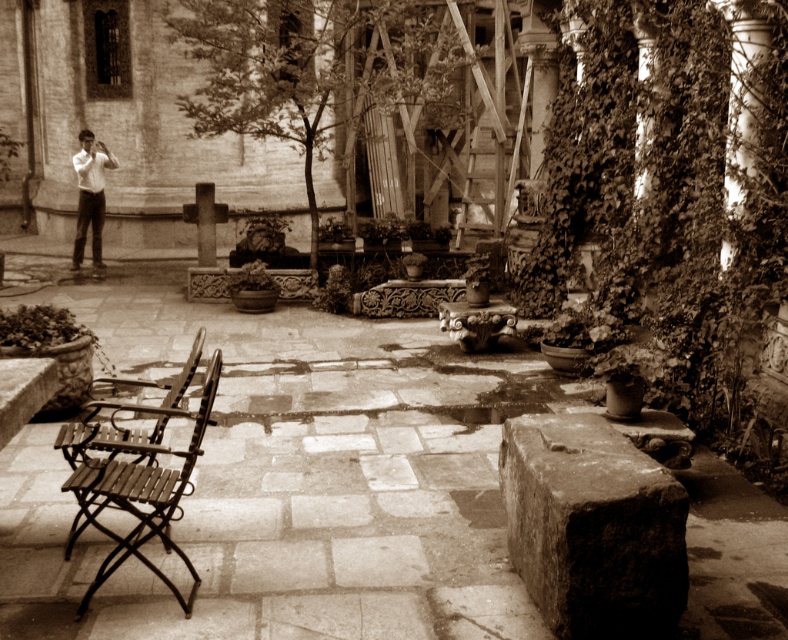
Is point (138, 464) positioned in front of point (207, 259)?

Yes, it is in front of point (207, 259).

Who is taller, metallic brown chair at lower left or smooth stone pillar at center?

metallic brown chair at lower left is taller.

Find the location of a particular element. The width and height of the screenshot is (788, 640). metallic brown chair at lower left is located at coordinates (132, 477).

Does white smooth column at right have a greater height compared to white shirt at left?

Yes.

Who is shorter, white smooth column at right or white shirt at left?

white shirt at left is shorter.

The width and height of the screenshot is (788, 640). Describe the element at coordinates (742, 100) in the screenshot. I see `white smooth column at right` at that location.

Where is `white smooth column at right`? The height and width of the screenshot is (640, 788). white smooth column at right is located at coordinates (742, 100).

Is white smooth column at right below smooth stone pillar at center?

Incorrect, white smooth column at right is not positioned below smooth stone pillar at center.

Consider the image. Who is higher up, white smooth column at right or smooth stone pillar at center?

Positioned higher is white smooth column at right.

Between point (727, 4) and point (197, 212), which one is positioned behind?

The point (197, 212) is more distant.

Identify the location of white smooth column at right. (742, 100).